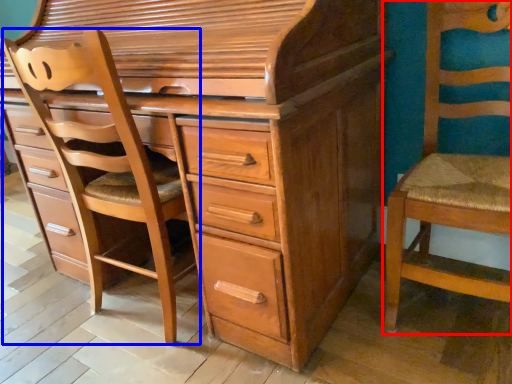
Question: Which object appears farthest to the camera in this image, chair (highlighted by a red box) or armchair (highlighted by a blue box)?

Choices:
 (A) chair
 (B) armchair

Answer: (B)